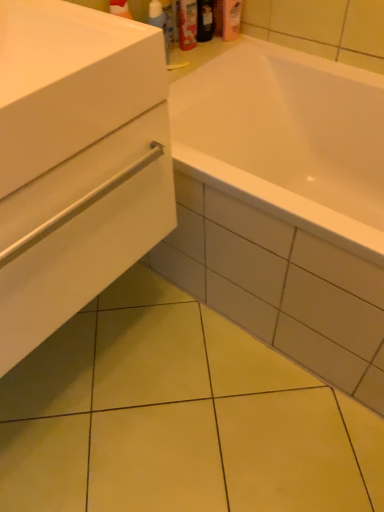
The height and width of the screenshot is (512, 384). Describe the element at coordinates (69, 82) in the screenshot. I see `white glossy sink at left` at that location.

The width and height of the screenshot is (384, 512). Identify the location of black glossy bottle at upper center, marked as the second toiletry in a right-to-left arrangement. (205, 20).

Where is `translucent plastic spray bottle at upper center`? The width and height of the screenshot is (384, 512). translucent plastic spray bottle at upper center is located at coordinates (159, 22).

Find the location of a particular element. white matte drawer at lower left is located at coordinates (81, 230).

Is black glossy bottle at upper center, acting as the 2th toiletry starting from the left, inside the boundaries of matte plastic shampoo bottle at upper center, arranged as the 1th toiletry when viewed from the left, or outside?

black glossy bottle at upper center, acting as the 2th toiletry starting from the left, lies outside matte plastic shampoo bottle at upper center, arranged as the 1th toiletry when viewed from the left.

From the picture: Is black glossy bottle at upper center, acting as the 2th toiletry starting from the left, positioned far away from matte plastic shampoo bottle at upper center, arranged as the 1th toiletry when viewed from the left?

No.

Is point (208, 36) less distant than point (184, 31)?

No, (208, 36) is behind (184, 31).

Is black glossy bottle at upper center, marked as the second toiletry in a right-to-left arrangement, positioned with its back to matte plastic shampoo bottle at upper center, arranged as the 1th toiletry when viewed from the left?

No.

From a real-world perspective, between matte plastic shampoo bottle at upper center, the 3th toiletry in the right-to-left sequence, and white glossy sink at left, who is vertically higher?

In real-world perspective, white glossy sink at left is above.

From the image's perspective, starting from the white glossy sink at left, which toiletry is the 1st one above? Please provide its 2D coordinates.

[(187, 24)]

From the image's perspective, is matte plastic shampoo bottle at upper center, the 3th toiletry in the right-to-left sequence, located above or below white glossy sink at left?

matte plastic shampoo bottle at upper center, the 3th toiletry in the right-to-left sequence, is situated higher than white glossy sink at left in the image.

What's the angular difference between matte plastic shampoo bottle at upper center, the 3th toiletry in the right-to-left sequence, and white matte drawer at lower left's facing directions?

The angle between the facing direction of matte plastic shampoo bottle at upper center, the 3th toiletry in the right-to-left sequence, and the facing direction of white matte drawer at lower left is 0.411 degrees.

In terms of width, does matte plastic shampoo bottle at upper center, arranged as the 1th toiletry when viewed from the left, look wider or thinner when compared to white matte drawer at lower left?

Clearly, matte plastic shampoo bottle at upper center, arranged as the 1th toiletry when viewed from the left, has less width compared to white matte drawer at lower left.

Between point (189, 44) and point (42, 180), which one is positioned behind?

The point (189, 44) is behind.

Does matte plastic shampoo bottle at upper center, arranged as the 1th toiletry when viewed from the left, have a larger size compared to white matte drawer at lower left?

No.

From a real-world perspective, which object rests below the other?

black glossy bottle at upper center, marked as the second toiletry in a right-to-left arrangement, from a real-world perspective.

Which is more to the left, black glossy bottle at upper center, marked as the second toiletry in a right-to-left arrangement, or pink matte lotion at upper center, placed as the third toiletry when sorted from left to right?

black glossy bottle at upper center, marked as the second toiletry in a right-to-left arrangement, is more to the left.

Is black glossy bottle at upper center, marked as the second toiletry in a right-to-left arrangement, aimed at pink matte lotion at upper center, marked as the 1th toiletry in a right-to-left arrangement?

No, black glossy bottle at upper center, marked as the second toiletry in a right-to-left arrangement, is not oriented towards pink matte lotion at upper center, marked as the 1th toiletry in a right-to-left arrangement.

Find the location of a particular element. Image resolution: width=384 pixels, height=512 pixels. toiletry behind the pink matte lotion at upper center, placed as the third toiletry when sorted from left to right is located at coordinates (205, 20).

Does pink matte lotion at upper center, placed as the third toiletry when sorted from left to right, appear on the left side of matte plastic shampoo bottle at upper center, the 3th toiletry in the right-to-left sequence?

Incorrect, pink matte lotion at upper center, placed as the third toiletry when sorted from left to right, is not on the left side of matte plastic shampoo bottle at upper center, the 3th toiletry in the right-to-left sequence.

Which object is closer to the camera, pink matte lotion at upper center, marked as the 1th toiletry in a right-to-left arrangement, or matte plastic shampoo bottle at upper center, arranged as the 1th toiletry when viewed from the left?

matte plastic shampoo bottle at upper center, arranged as the 1th toiletry when viewed from the left, is more forward.

Which of these two, pink matte lotion at upper center, placed as the third toiletry when sorted from left to right, or matte plastic shampoo bottle at upper center, arranged as the 1th toiletry when viewed from the left, is wider?

Wider between the two is pink matte lotion at upper center, placed as the third toiletry when sorted from left to right.

Which of these two, pink matte lotion at upper center, placed as the third toiletry when sorted from left to right, or matte plastic shampoo bottle at upper center, the 3th toiletry in the right-to-left sequence, is smaller?

matte plastic shampoo bottle at upper center, the 3th toiletry in the right-to-left sequence, is smaller.

Is point (164, 24) farther from viewer compared to point (205, 5)?

That is False.

How many degrees apart are the facing directions of translucent plastic spray bottle at upper center and black glossy bottle at upper center, acting as the 2th toiletry starting from the left?

The angle between the facing direction of translucent plastic spray bottle at upper center and the facing direction of black glossy bottle at upper center, acting as the 2th toiletry starting from the left, is 0.000132 degrees.

In the image, is translucent plastic spray bottle at upper center positioned in front of or behind black glossy bottle at upper center, marked as the second toiletry in a right-to-left arrangement?

In the image, translucent plastic spray bottle at upper center appears in front of black glossy bottle at upper center, marked as the second toiletry in a right-to-left arrangement.

Are translucent plastic spray bottle at upper center and black glossy bottle at upper center, acting as the 2th toiletry starting from the left, making contact?

No, translucent plastic spray bottle at upper center is not beside black glossy bottle at upper center, acting as the 2th toiletry starting from the left.

Is white glossy sink at left oriented towards matte plastic shampoo bottle at upper center, arranged as the 1th toiletry when viewed from the left?

No, white glossy sink at left does not turn towards matte plastic shampoo bottle at upper center, arranged as the 1th toiletry when viewed from the left.

From the image's perspective, which one is positioned higher, white glossy sink at left or matte plastic shampoo bottle at upper center, arranged as the 1th toiletry when viewed from the left?

matte plastic shampoo bottle at upper center, arranged as the 1th toiletry when viewed from the left.

Would you say white glossy sink at left is outside matte plastic shampoo bottle at upper center, arranged as the 1th toiletry when viewed from the left?

Indeed, white glossy sink at left is completely outside matte plastic shampoo bottle at upper center, arranged as the 1th toiletry when viewed from the left.

In the scene shown: In terms of width, does white glossy sink at left look wider or thinner when compared to matte plastic shampoo bottle at upper center, the 3th toiletry in the right-to-left sequence?

Clearly, white glossy sink at left has more width compared to matte plastic shampoo bottle at upper center, the 3th toiletry in the right-to-left sequence.

From a real-world perspective, starting from the matte plastic shampoo bottle at upper center, arranged as the 1th toiletry when viewed from the left, which toiletry is the 1st one vertically above it? Please provide its 2D coordinates.

[(205, 20)]

At what (x,y) coordinates should I click in order to perform the action: click on toiletry that is the 1st one when counting rightward from the white glossy sink at left. Please return your answer as a coordinate pair (x, y). Image resolution: width=384 pixels, height=512 pixels. Looking at the image, I should click on (187, 24).

Which object lies further to the anchor point white matte drawer at lower left, translucent plastic spray bottle at upper center or pink matte lotion at upper center, marked as the 1th toiletry in a right-to-left arrangement?

Among the two, pink matte lotion at upper center, marked as the 1th toiletry in a right-to-left arrangement, is located further to white matte drawer at lower left.

From the image, which object appears to be nearer to black glossy bottle at upper center, marked as the second toiletry in a right-to-left arrangement, matte plastic shampoo bottle at upper center, arranged as the 1th toiletry when viewed from the left, or white glossy sink at left?

Based on the image, matte plastic shampoo bottle at upper center, arranged as the 1th toiletry when viewed from the left, appears to be nearer to black glossy bottle at upper center, marked as the second toiletry in a right-to-left arrangement.

From the image, which object appears to be farther from white glossy sink at left, matte plastic shampoo bottle at upper center, arranged as the 1th toiletry when viewed from the left, or white matte drawer at lower left?

The object further to white glossy sink at left is matte plastic shampoo bottle at upper center, arranged as the 1th toiletry when viewed from the left.

Based on their spatial positions, is white glossy sink at left or translucent plastic spray bottle at upper center further from pink matte lotion at upper center, placed as the third toiletry when sorted from left to right?

Based on the image, white glossy sink at left appears to be further to pink matte lotion at upper center, placed as the third toiletry when sorted from left to right.

Which object lies further to the anchor point translucent plastic spray bottle at upper center, black glossy bottle at upper center, marked as the second toiletry in a right-to-left arrangement, or white glossy sink at left?

white glossy sink at left is further to translucent plastic spray bottle at upper center.

Based on the photo, estimate the real-world distances between objects in this image. Which object is further from matte plastic shampoo bottle at upper center, the 3th toiletry in the right-to-left sequence, white matte drawer at lower left or black glossy bottle at upper center, acting as the 2th toiletry starting from the left?

The object further to matte plastic shampoo bottle at upper center, the 3th toiletry in the right-to-left sequence, is white matte drawer at lower left.

Estimate the real-world distances between objects in this image. Which object is closer to black glossy bottle at upper center, marked as the second toiletry in a right-to-left arrangement, pink matte lotion at upper center, placed as the third toiletry when sorted from left to right, or white matte drawer at lower left?

The object closer to black glossy bottle at upper center, marked as the second toiletry in a right-to-left arrangement, is pink matte lotion at upper center, placed as the third toiletry when sorted from left to right.

Considering their positions, is translucent plastic spray bottle at upper center positioned further to black glossy bottle at upper center, marked as the second toiletry in a right-to-left arrangement, than pink matte lotion at upper center, placed as the third toiletry when sorted from left to right?

translucent plastic spray bottle at upper center is positioned further to the anchor black glossy bottle at upper center, marked as the second toiletry in a right-to-left arrangement.

This screenshot has height=512, width=384. Identify the location of toiletry between translucent plastic spray bottle at upper center and black glossy bottle at upper center, marked as the second toiletry in a right-to-left arrangement, in the horizontal direction. (187, 24).

The image size is (384, 512). I want to click on drawer between white glossy sink at left and pink matte lotion at upper center, placed as the third toiletry when sorted from left to right, along the z-axis, so click(81, 230).

Where is `cleaning product between white glossy sink at left and black glossy bottle at upper center, acting as the 2th toiletry starting from the left, from front to back`? Image resolution: width=384 pixels, height=512 pixels. cleaning product between white glossy sink at left and black glossy bottle at upper center, acting as the 2th toiletry starting from the left, from front to back is located at coordinates (159, 22).

Where is `toiletry between matte plastic shampoo bottle at upper center, arranged as the 1th toiletry when viewed from the left, and pink matte lotion at upper center, marked as the 1th toiletry in a right-to-left arrangement, from left to right`? toiletry between matte plastic shampoo bottle at upper center, arranged as the 1th toiletry when viewed from the left, and pink matte lotion at upper center, marked as the 1th toiletry in a right-to-left arrangement, from left to right is located at coordinates (205, 20).